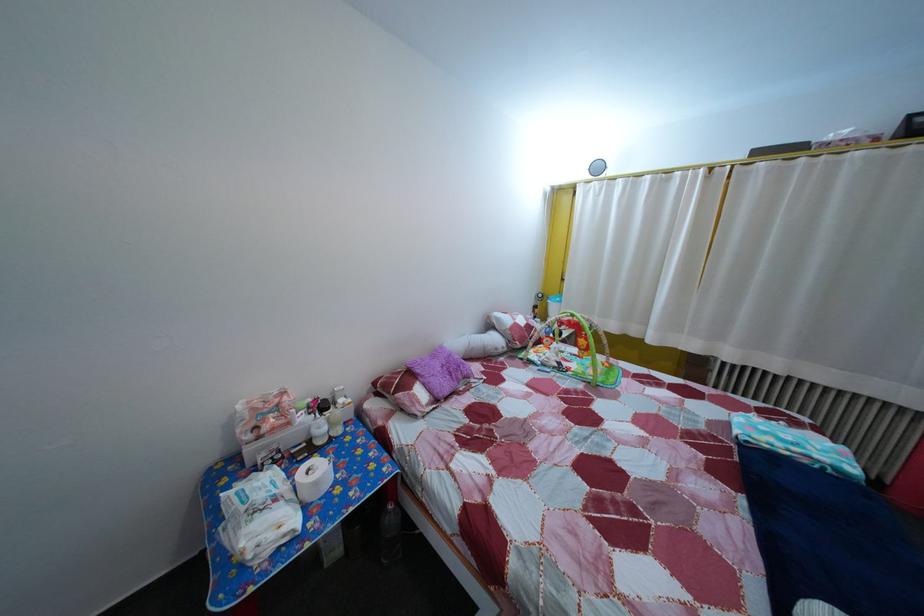
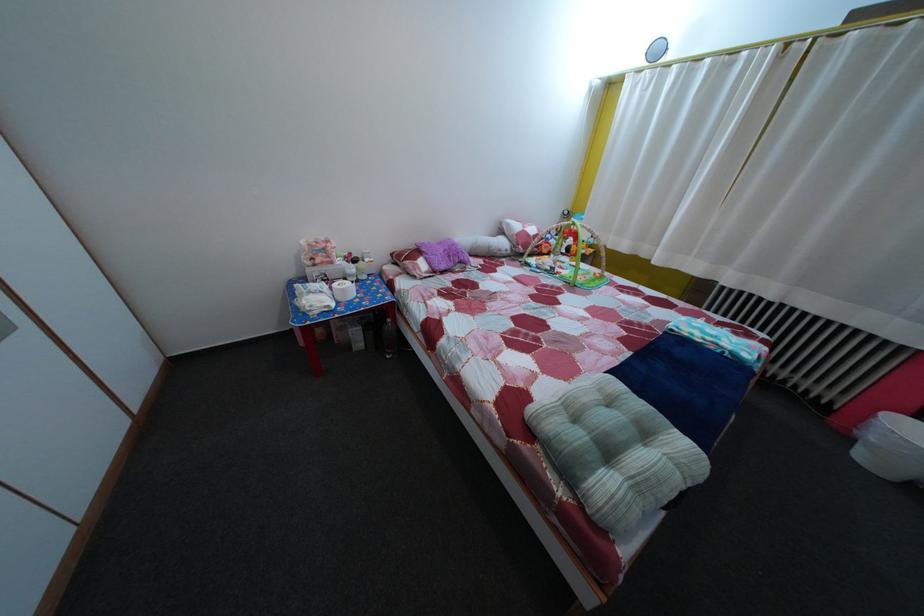
Question: The first image is from the beginning of the video and the second image is from the end. How did the camera likely rotate when shooting the video?

Choices:
 (A) Left
 (B) Right
 (C) Up
 (D) Down

Answer: (D)